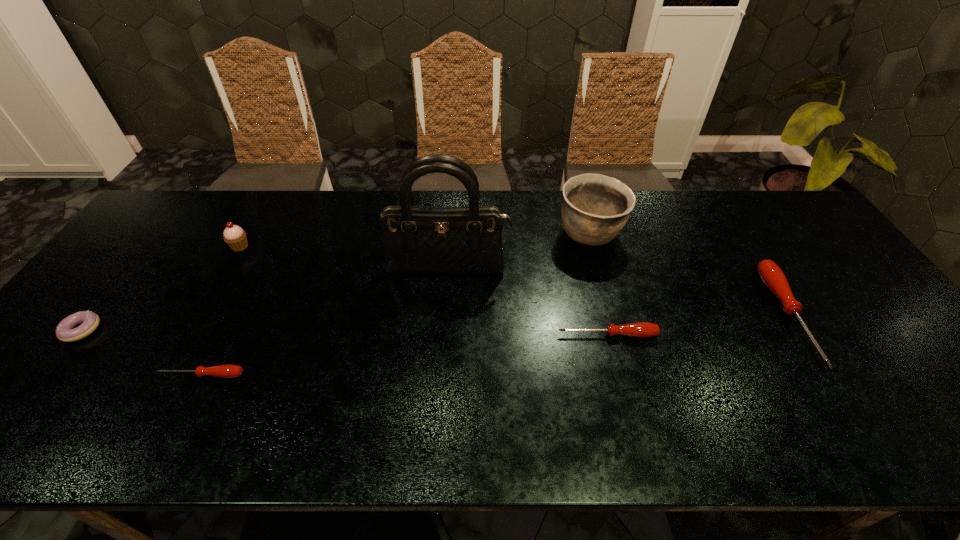
This screenshot has width=960, height=540. Identify the location of the shortest screwdriver. (224, 371).

Find the location of a particular element. The height and width of the screenshot is (540, 960). the fifth tallest object is located at coordinates (641, 329).

The height and width of the screenshot is (540, 960). Identify the location of the second screwdriver from left to right. (641, 329).

Where is `the tallest screwdriver`? the tallest screwdriver is located at coordinates (772, 276).

At what (x,y) coordinates should I click in order to perform the action: click on the fourth tallest object. Please return your answer as a coordinate pair (x, y). This screenshot has width=960, height=540. Looking at the image, I should click on (772, 276).

Locate an element on the screen. This screenshot has height=540, width=960. the fifth shortest object is located at coordinates (234, 236).

Locate an element on the screen. This screenshot has width=960, height=540. the second tallest object is located at coordinates (595, 208).

You are a GUI agent. You are given a task and a screenshot of the screen. Output one action in this format:
    pyautogui.click(x=<x>, y=<y>)
    Task: Click on the leftmost object
    
    Given the screenshot: What is the action you would take?
    pyautogui.click(x=90, y=321)

I want to click on handbag, so click(x=417, y=240).

I want to click on the tallest object, so click(417, 240).